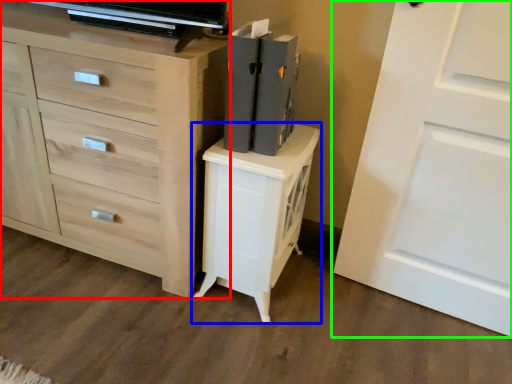
Question: Which object is positioned farthest from chest of drawers (highlighted by a red box)? Select from nightstand (highlighted by a blue box) and door (highlighted by a green box).

Choices:
 (A) nightstand
 (B) door

Answer: (B)